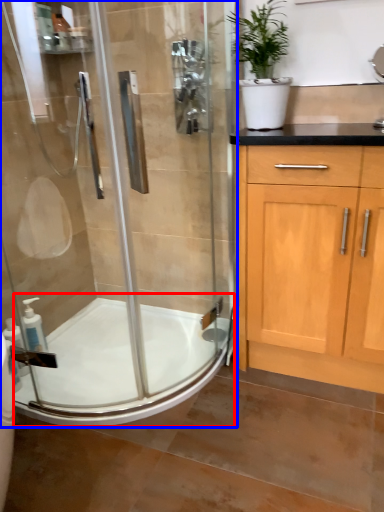
Question: Which object appears closest to the camera in this image, bath (highlighted by a red box) or shower door (highlighted by a blue box)?

Choices:
 (A) bath
 (B) shower door

Answer: (B)